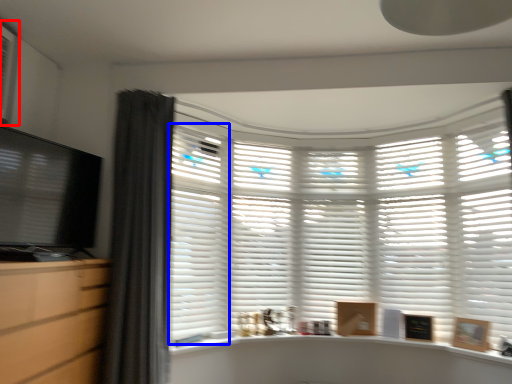
Question: Which point is closer to the camera, air conditioner (highlighted by a red box) or shutter (highlighted by a blue box)?

Choices:
 (A) air conditioner
 (B) shutter

Answer: (A)